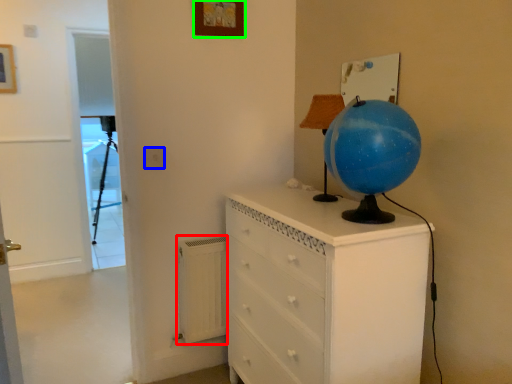
Question: Considering the real-world distances, which object is closest to radiator (highlighted by a red box)? electric outlet (highlighted by a blue box) or picture frame (highlighted by a green box).

Choices:
 (A) electric outlet
 (B) picture frame

Answer: (A)